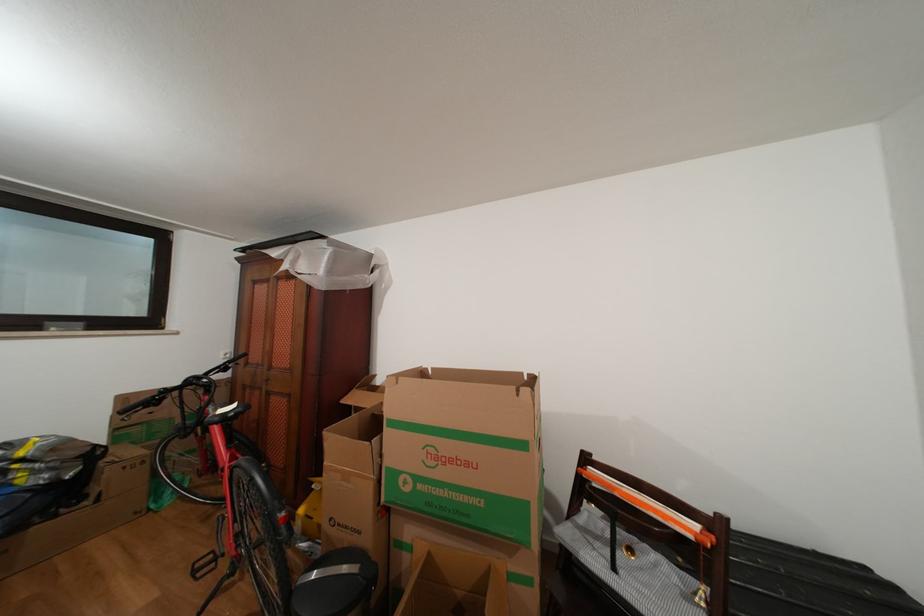
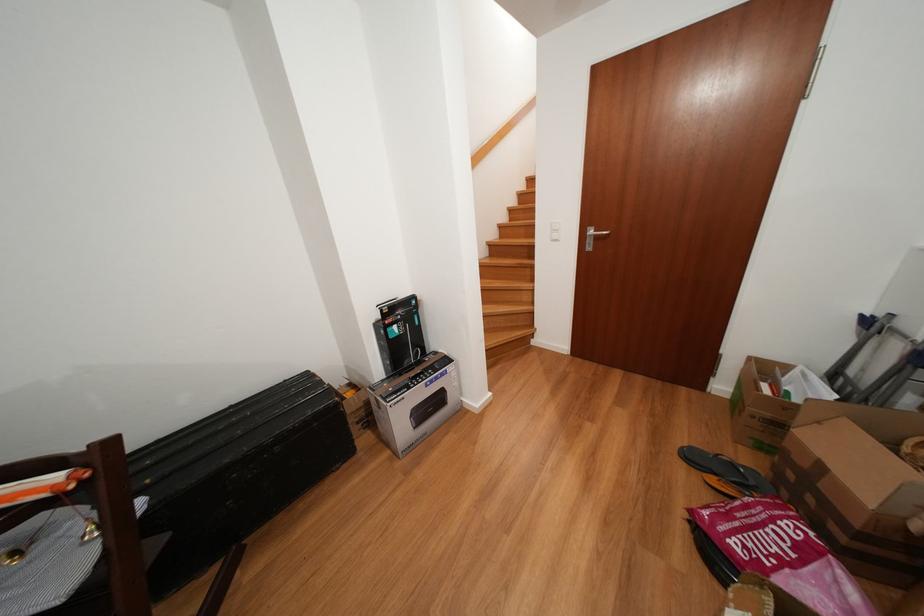
Based on the continuous images, in which direction is the camera rotating?

The rotation direction of the camera is right-down.